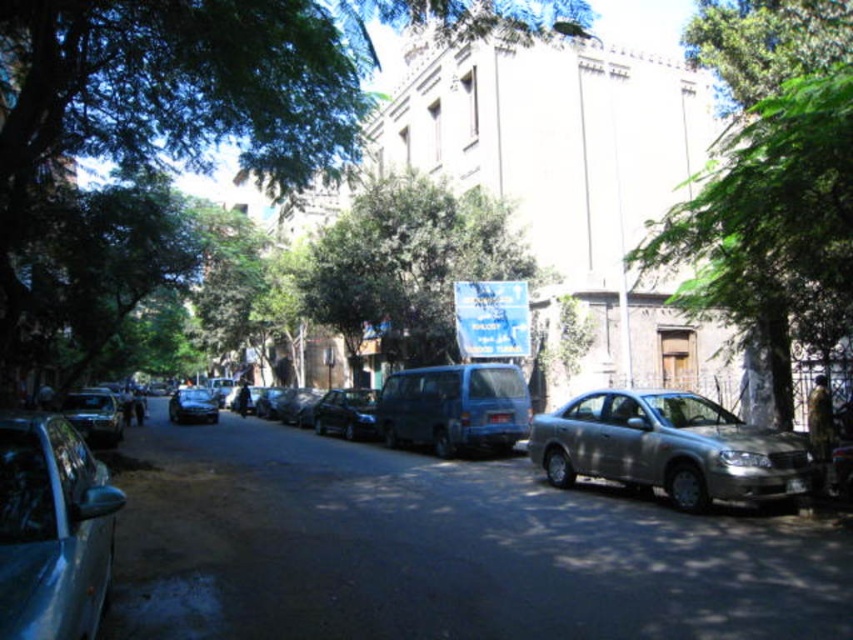
You are a photographer standing at the center of the street. You want to take a photo that includes both the blue signboard with Arabic text and the large building with rectangular windows. Which of the two points, point (242, 90) or point (498, 449), should you stand closer to in order to ensure both subjects are in frame?

You should stand closer to point (242, 90) because it is closer to the camera, allowing both the blue signboard with Arabic text and the large building with rectangular windows to be captured within the frame.

You are a delivery driver who needs to park your vehicle. You see a silver metallic sedan at right and a blue matte van at center. Which vehicle is parked closer to you so you can park behind it?

The silver metallic sedan at right is closer to the viewer than the blue matte van at center, so you can park behind it.

You are a pedestrian standing at the center of the street. You need to cross to the building with the Arabic sign. Which car should you walk around first, the silver metallic sedan at right or the shiny silver car at lower left?

You should walk around the shiny silver car at lower left first because the silver metallic sedan at right is to the right of it, so the shiny silver car at lower left is closer to your starting position at the center.